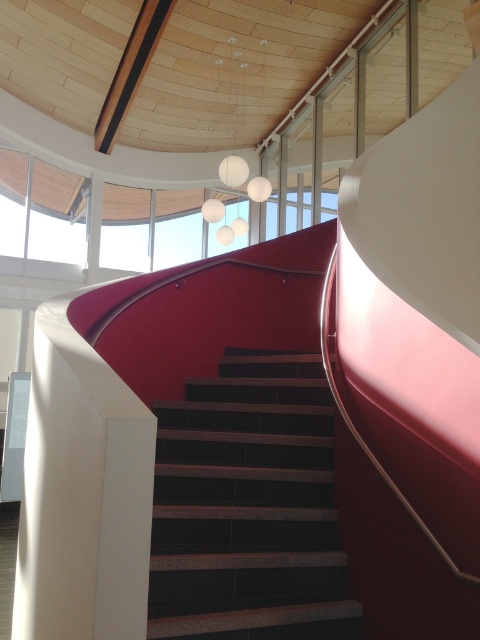
Question: Is dark brown textured stairs at center to the right of clear glass window at upper left from the viewer's perspective?

Choices:
 (A) yes
 (B) no

Answer: (A)

Question: Is the position of dark brown textured stairs at center more distant than that of clear glass window at upper left?

Choices:
 (A) no
 (B) yes

Answer: (A)

Question: Which point is farther to the camera?

Choices:
 (A) (60, 218)
 (B) (288, 509)

Answer: (A)

Question: From the image, what is the correct spatial relationship of dark brown textured stairs at center in relation to clear glass window at upper left?

Choices:
 (A) left
 (B) right

Answer: (B)